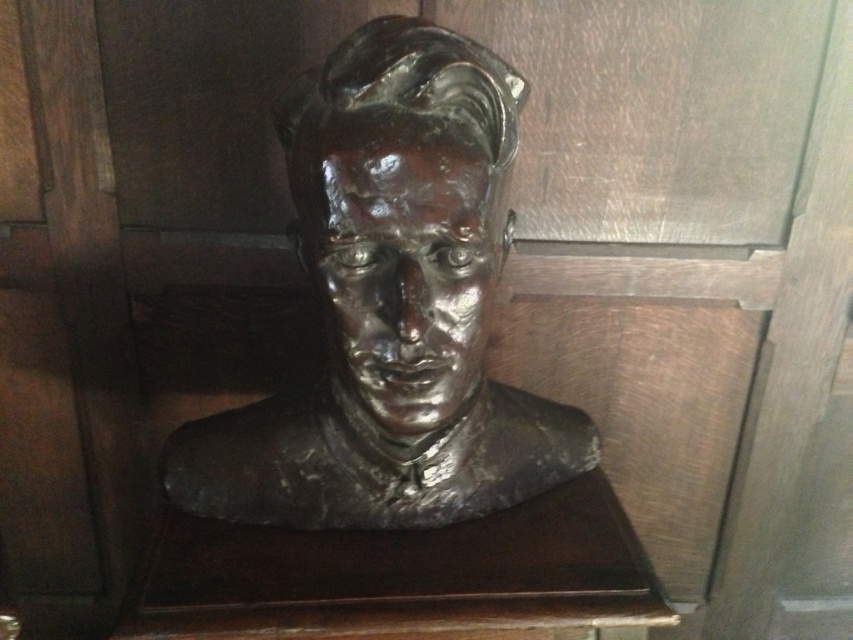
Question: Can you confirm if shiny bronze bust at center is positioned to the right of bronze bust at center?

Choices:
 (A) yes
 (B) no

Answer: (B)

Question: Can you confirm if shiny bronze bust at center is positioned below bronze bust at center?

Choices:
 (A) no
 (B) yes

Answer: (B)

Question: Which point appears closest to the camera in this image?

Choices:
 (A) (511, 70)
 (B) (467, 310)

Answer: (B)

Question: Can you confirm if shiny bronze bust at center is wider than bronze bust at center?

Choices:
 (A) yes
 (B) no

Answer: (A)

Question: Which of the following is the farthest from the observer?

Choices:
 (A) shiny bronze bust at center
 (B) bronze bust at center

Answer: (A)